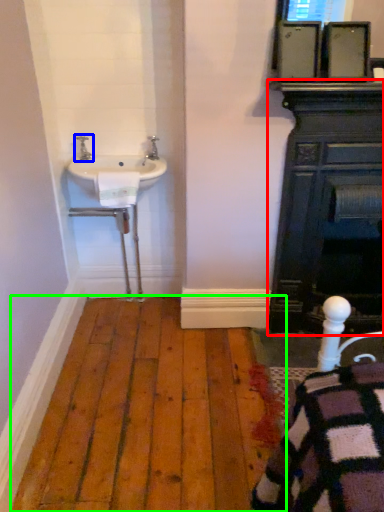
Question: Estimate the real-world distances between objects in this image. Which object is closer to bathroom cabinet (highlighted by a red box), tap (highlighted by a blue box) or hardwood (highlighted by a green box)?

Choices:
 (A) tap
 (B) hardwood

Answer: (B)